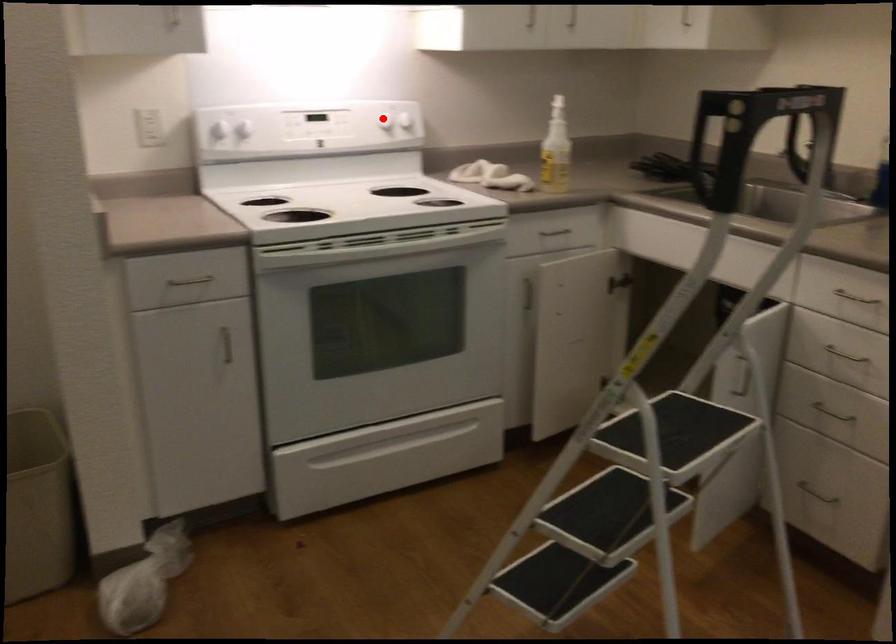
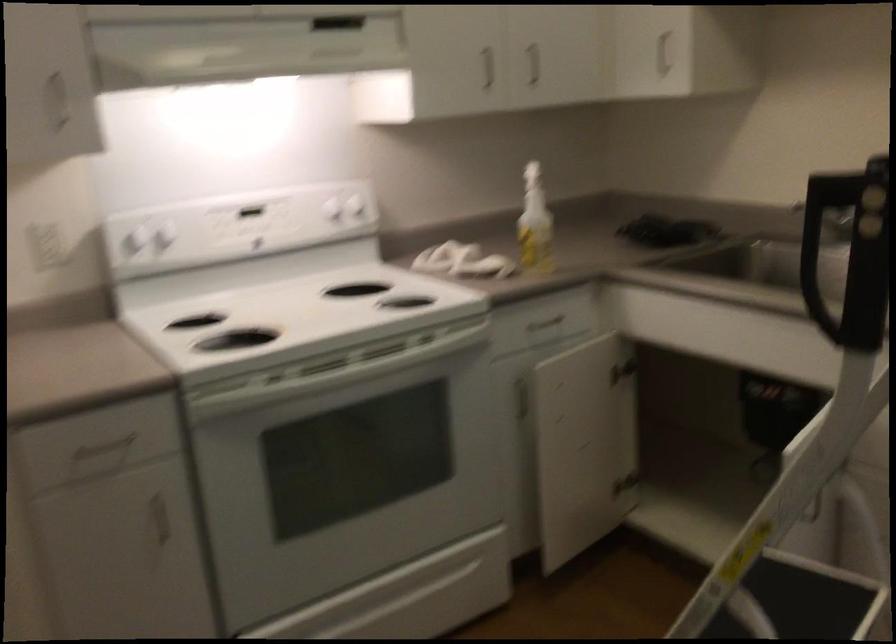
In the second image, find the point that corresponds to the highlighted location in the first image.

(332, 210)